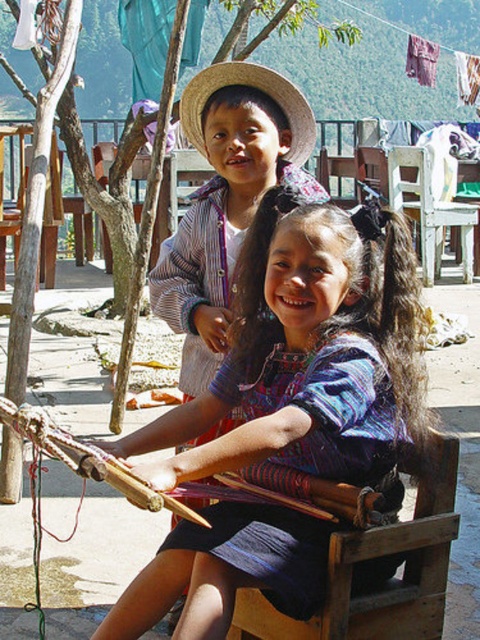
Question: Which is farther from the wooden chair at left?

Choices:
 (A) white plastic chair at center
 (B) blue woven fabric at center

Answer: (B)

Question: Considering the relative positions of matte straw hat at upper center and wooden chair at left in the image provided, where is matte straw hat at upper center located with respect to wooden chair at left?

Choices:
 (A) right
 (B) left

Answer: (A)

Question: Does blue woven fabric at center appear on the left side of matte straw hat at upper center?

Choices:
 (A) no
 (B) yes

Answer: (A)

Question: Among these objects, which one is nearest to the camera?

Choices:
 (A) wooden chair at left
 (B) wooden chair at lower center
 (C) straw hat at upper center
 (D) white plastic chair at center

Answer: (B)

Question: Is matte straw hat at upper center wider than wooden chair at lower center?

Choices:
 (A) no
 (B) yes

Answer: (B)

Question: Which object is positioned farthest from the matte straw hat at upper center?

Choices:
 (A) straw hat at upper center
 (B) wooden chair at lower center
 (C) wooden chair at left

Answer: (C)